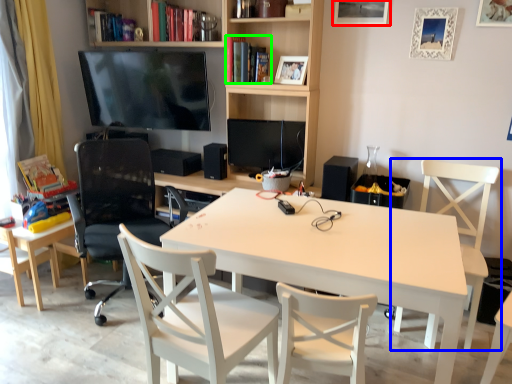
Question: Estimate the real-world distances between objects in this image. Which object is farther from picture frame (highlighted by a red box), chair (highlighted by a blue box) or book (highlighted by a green box)?

Choices:
 (A) chair
 (B) book

Answer: (A)